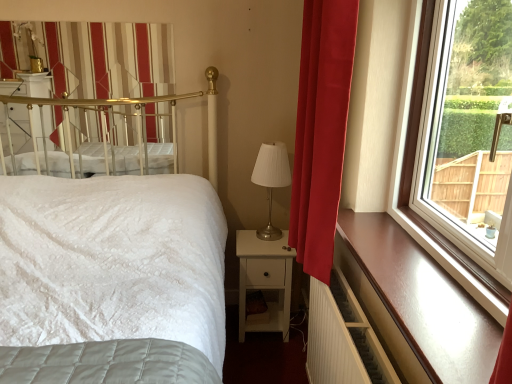
I want to click on gold metallic canopy bed at upper left, so click(x=102, y=133).

Locate an element on the screen. brown polished wood ledge at right is located at coordinates (415, 303).

Find the location of a particular element. The height and width of the screenshot is (384, 512). red velvet curtain at right is located at coordinates pos(321,130).

At what (x,y) coordinates should I click in order to perform the action: click on metallic silver table lamp at center. Please return your answer as a coordinate pair (x, y). The width and height of the screenshot is (512, 384). Looking at the image, I should click on (271, 180).

In order to face white matte nightstand at center, should I rotate leftwards or rightwards?

Rotate right and turn 1.323 degrees.

Where is `white glossy radiator at lower right`? white glossy radiator at lower right is located at coordinates (343, 338).

Locate an element on the screen. gold metallic canopy bed at upper left is located at coordinates (102, 133).

Considering the sizes of red velvet curtain at right and white matte nightstand at center in the image, is red velvet curtain at right wider or thinner than white matte nightstand at center?

Clearly, red velvet curtain at right has less width compared to white matte nightstand at center.

Is white matte nightstand at center at the back of red velvet curtain at right?

No, red velvet curtain at right's orientation is not away from white matte nightstand at center.

From the image's perspective, is red velvet curtain at right positioned above or below white matte nightstand at center?

red velvet curtain at right is situated higher than white matte nightstand at center in the image.

This screenshot has height=384, width=512. I want to click on nightstand directly beneath the red velvet curtain at right (from a real-world perspective), so click(x=264, y=280).

Considering the sizes of objects gold metallic canopy bed at upper left and red velvet curtain at right in the image provided, who is wider, gold metallic canopy bed at upper left or red velvet curtain at right?

red velvet curtain at right.

You are a GUI agent. You are given a task and a screenshot of the screen. Output one action in this format:
    pyautogui.click(x=<x>, y=<y>)
    Task: Click on the curtain that appears below the gold metallic canopy bed at upper left (from the image's perspective)
    Image resolution: width=512 pixels, height=384 pixels.
    Given the screenshot: What is the action you would take?
    pyautogui.click(x=321, y=130)

Can you confirm if gold metallic canopy bed at upper left is shorter than red velvet curtain at right?

Yes, gold metallic canopy bed at upper left is shorter than red velvet curtain at right.

From the image's perspective, is gold metallic canopy bed at upper left positioned above or below red velvet curtain at right?

gold metallic canopy bed at upper left is above red velvet curtain at right.

Is white matte nightstand at center inside or outside of metallic silver table lamp at center?

white matte nightstand at center is not enclosed by metallic silver table lamp at center.

Identify the location of nightstand lying behind the metallic silver table lamp at center. (264, 280).

Which is farther from the camera, (278, 246) or (267, 235)?

The point (267, 235) is farther from the camera.

Would you consider white matte nightstand at center to be distant from metallic silver table lamp at center?

No, white matte nightstand at center is not far away from metallic silver table lamp at center.

Is brown polished wood ledge at right taller than gold metallic canopy bed at upper left?

In fact, brown polished wood ledge at right may be shorter than gold metallic canopy bed at upper left.

Would you say brown polished wood ledge at right is outside gold metallic canopy bed at upper left?

Indeed, brown polished wood ledge at right is completely outside gold metallic canopy bed at upper left.

Considering the points (264, 285) and (312, 29), which point is in front, point (264, 285) or point (312, 29)?

The point (312, 29) is more forward.

From a real-world perspective, between white matte nightstand at center and red velvet curtain at right, who is vertically higher?

red velvet curtain at right, from a real-world perspective.

Is white matte nightstand at center taller or shorter than red velvet curtain at right?

Clearly, white matte nightstand at center is shorter compared to red velvet curtain at right.

In the scene shown: Considering the relative sizes of white matte nightstand at center and red velvet curtain at right in the image provided, is white matte nightstand at center smaller than red velvet curtain at right?

Correct, white matte nightstand at center occupies less space than red velvet curtain at right.

Which of these two, brown polished wood ledge at right or white matte nightstand at center, is smaller?

brown polished wood ledge at right is smaller.

Who is shorter, brown polished wood ledge at right or white matte nightstand at center?

brown polished wood ledge at right.

In the scene shown: Can you confirm if brown polished wood ledge at right is thinner than white matte nightstand at center?

Yes, brown polished wood ledge at right is thinner than white matte nightstand at center.

Considering the relative sizes of gold metallic canopy bed at upper left and white glossy radiator at lower right in the image provided, is gold metallic canopy bed at upper left thinner than white glossy radiator at lower right?

Yes.

In terms of height, does gold metallic canopy bed at upper left look taller or shorter compared to white glossy radiator at lower right?

gold metallic canopy bed at upper left is taller than white glossy radiator at lower right.

Is gold metallic canopy bed at upper left positioned before white glossy radiator at lower right?

No, gold metallic canopy bed at upper left is further to the viewer.

Would you consider gold metallic canopy bed at upper left to be distant from white glossy radiator at lower right?

Yes, gold metallic canopy bed at upper left and white glossy radiator at lower right are quite far apart.

The height and width of the screenshot is (384, 512). I want to click on curtain in front of the white matte nightstand at center, so click(x=321, y=130).

Locate an element on the screen. The height and width of the screenshot is (384, 512). canopy bed on the left of the red velvet curtain at right is located at coordinates (102, 133).

Considering their positions, is white glossy radiator at lower right positioned closer to metallic silver table lamp at center than gold metallic canopy bed at upper left?

gold metallic canopy bed at upper left is closer to metallic silver table lamp at center.

From the image, which object appears to be farther from white matte nightstand at center, gold metallic canopy bed at upper left or white glossy radiator at lower right?

Among the two, gold metallic canopy bed at upper left is located further to white matte nightstand at center.

Which object lies further to the anchor point gold metallic canopy bed at upper left, red velvet curtain at right or white matte nightstand at center?

red velvet curtain at right.

Estimate the real-world distances between objects in this image. Which object is further from white matte nightstand at center, red velvet curtain at right or brown polished wood ledge at right?

Among the two, brown polished wood ledge at right is located further to white matte nightstand at center.

When comparing their distances from red velvet curtain at right, does brown polished wood ledge at right or white matte nightstand at center seem further?

white matte nightstand at center is further to red velvet curtain at right.

Which object lies further to the anchor point white glossy radiator at lower right, gold metallic canopy bed at upper left or white matte nightstand at center?

gold metallic canopy bed at upper left lies further to white glossy radiator at lower right than the other object.

Estimate the real-world distances between objects in this image. Which object is further from gold metallic canopy bed at upper left, white glossy radiator at lower right or brown polished wood ledge at right?

brown polished wood ledge at right.

Based on the photo, from the image, which object appears to be farther from red velvet curtain at right, white glossy radiator at lower right or white matte nightstand at center?

Based on the image, white matte nightstand at center appears to be further to red velvet curtain at right.

Locate an element on the screen. The image size is (512, 384). canopy bed between brown polished wood ledge at right and white matte nightstand at center from front to back is located at coordinates (102, 133).

The image size is (512, 384). I want to click on curtain located between white glossy radiator at lower right and white matte nightstand at center in the depth direction, so 321,130.

You are a GUI agent. You are given a task and a screenshot of the screen. Output one action in this format:
    pyautogui.click(x=<x>, y=<y>)
    Task: Click on the curtain located between gold metallic canopy bed at upper left and brown polished wood ledge at right in the left-right direction
    The height and width of the screenshot is (384, 512).
    Given the screenshot: What is the action you would take?
    pyautogui.click(x=321, y=130)

Locate an element on the screen. The width and height of the screenshot is (512, 384). curtain between brown polished wood ledge at right and metallic silver table lamp at center in the front-back direction is located at coordinates (321, 130).